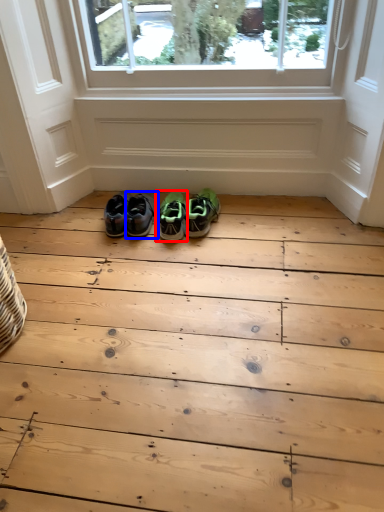
Question: Which of the following is the closest to the observer, footwear (highlighted by a red box) or footwear (highlighted by a blue box)?

Choices:
 (A) footwear
 (B) footwear

Answer: (A)